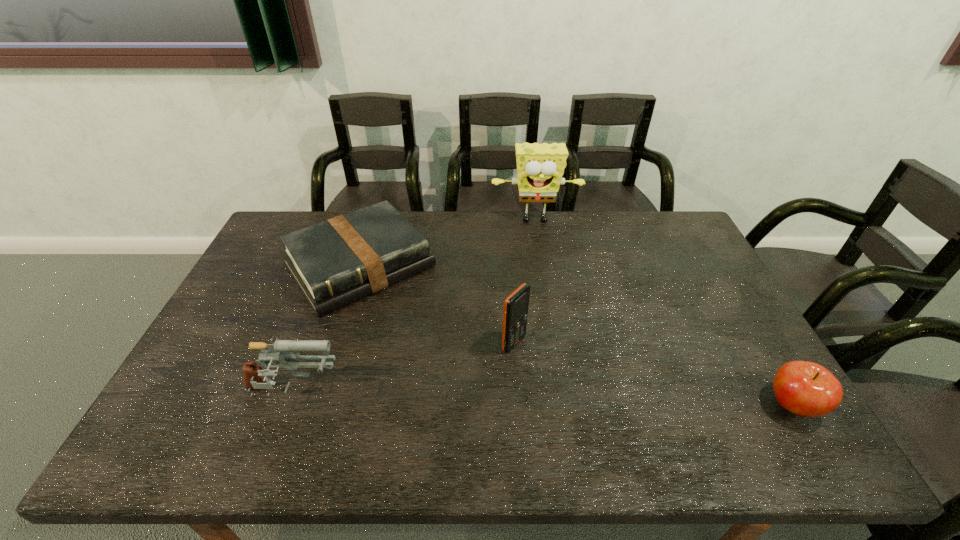
Identify the location of object that is the fourth closest to the rightmost object. (280, 351).

I want to click on object that is the fourth nearest to the gun, so click(807, 389).